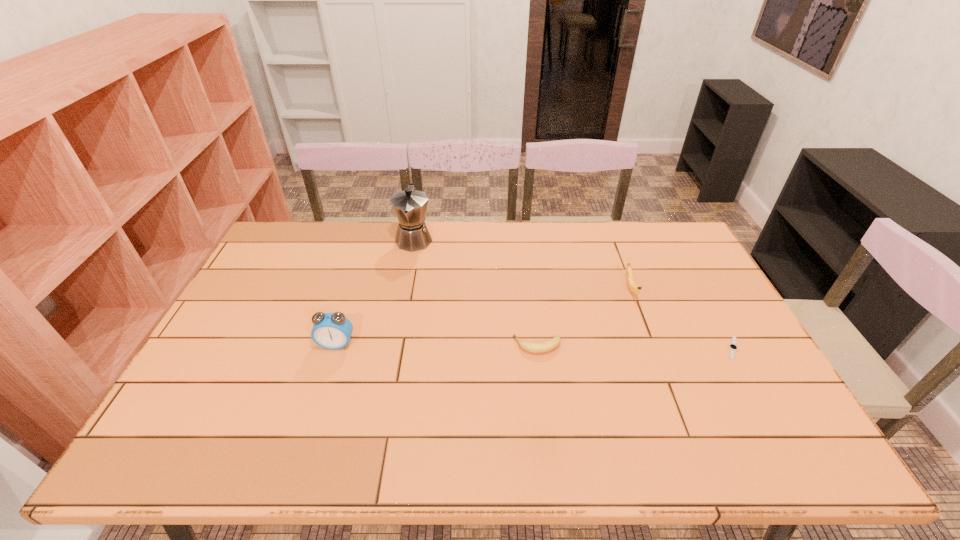
The height and width of the screenshot is (540, 960). Identify the location of free location located at the spout of the tallest object. (401, 308).

The width and height of the screenshot is (960, 540). What are the coordinates of `vacant point located 0.090m on the face of the fourth shortest object` in the screenshot? It's located at (325, 378).

Find the location of a particular element. free space located 0.160m at the stem of the second farthest object is located at coordinates (651, 343).

This screenshot has width=960, height=540. In order to click on vacant space positioned at the stem of the fourth tallest object in this screenshot , I will do `click(426, 346)`.

Where is `vacant position located at the stem of the fourth tallest object`? vacant position located at the stem of the fourth tallest object is located at coordinates (459, 346).

Where is `free spot located 0.340m at the stem of the fourth tallest object`? This screenshot has width=960, height=540. free spot located 0.340m at the stem of the fourth tallest object is located at coordinates (391, 346).

Identify the location of vacant space located 0.120m on the back of the shortest object. This screenshot has height=540, width=960. click(709, 307).

At what (x,y) coordinates should I click in order to perform the action: click on object positioned at the far edge. Please return your answer as a coordinate pair (x, y). This screenshot has height=540, width=960. Looking at the image, I should click on (410, 206).

This screenshot has height=540, width=960. I want to click on object that is at the right edge, so click(x=732, y=346).

Where is `vacant space at the far edge`? The image size is (960, 540). vacant space at the far edge is located at coordinates (451, 243).